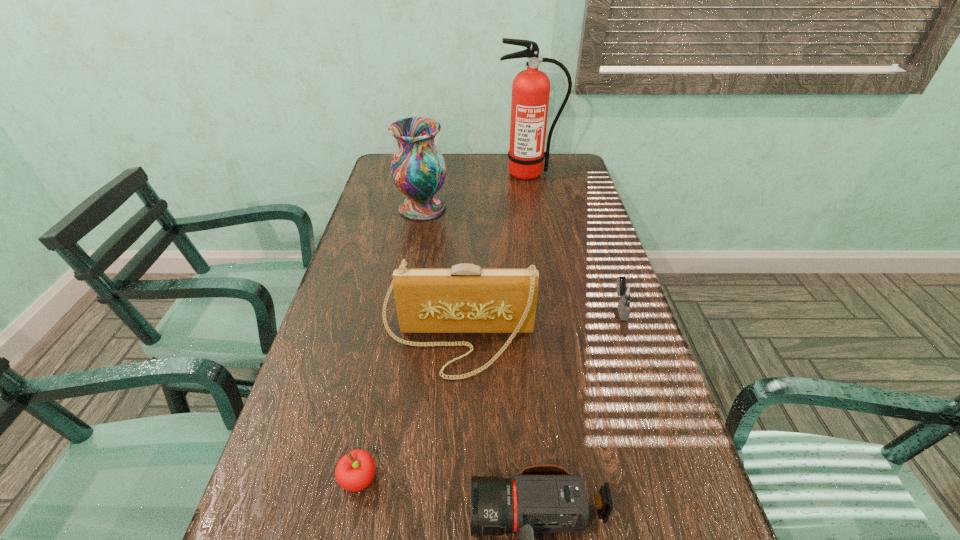
The image size is (960, 540). I want to click on blank area located 0.340m on the back of the igniter, so click(591, 224).

Image resolution: width=960 pixels, height=540 pixels. Find the location of `vacant space located on the back of the apple`. vacant space located on the back of the apple is located at coordinates (390, 329).

The height and width of the screenshot is (540, 960). What are the coordinates of `object present at the far edge` in the screenshot? It's located at (531, 88).

I want to click on vase that is at the left edge, so click(418, 169).

Locate an element on the screen. handbag that is at the left edge is located at coordinates (465, 298).

Find the location of `apple that is positioned at the left edge`. apple that is positioned at the left edge is located at coordinates (355, 471).

The height and width of the screenshot is (540, 960). In order to click on fire extinguisher positioned at the right edge in this screenshot , I will do `click(531, 88)`.

The width and height of the screenshot is (960, 540). Find the location of `igniter present at the right edge`. igniter present at the right edge is located at coordinates (626, 292).

This screenshot has width=960, height=540. What are the coordinates of `object that is positioned at the far right corner` in the screenshot? It's located at (531, 88).

Identify the location of vacant space at the far edge of the desktop. (467, 164).